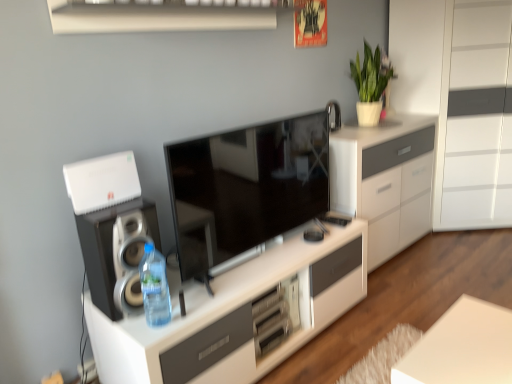
Question: Is point (106, 8) positioned closer to the camera than point (393, 221)?

Choices:
 (A) farther
 (B) closer

Answer: (B)

Question: Would you say white glossy shelf at upper center is inside or outside white glossy cabinet at center, placed as the second cabinetry when sorted from bottom to top?

Choices:
 (A) outside
 (B) inside

Answer: (A)

Question: Which is farther from the white glossy shelf at upper center?

Choices:
 (A) white matte plant at upper right
 (B) white matte table at lower right
 (C) white glossy cabinet at center, positioned as the 1th cabinetry in top-to-bottom order
 (D) white glossy cabinet at center, which appears as the first cabinetry when ordered from the bottom
 (E) white plastic router at upper left

Answer: (B)

Question: Estimate the real-world distances between objects in this image. Which object is closer to the translucent plastic bottle at lower left?

Choices:
 (A) white glossy cabinet at center, positioned as the 1th cabinetry in top-to-bottom order
 (B) matte black tv at center
 (C) matte black speaker at left
 (D) white glossy shelf at upper center
 (E) white matte plant at upper right

Answer: (C)